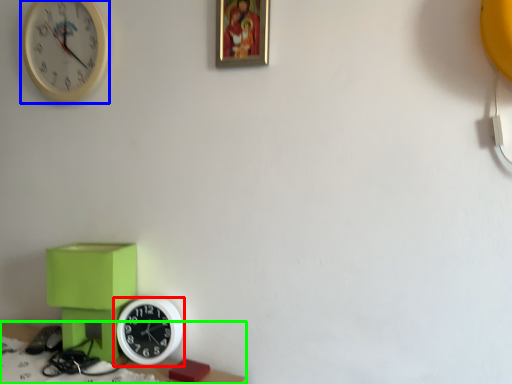
Question: Estimate the real-world distances between objects in this image. Which object is farther from wall clock (highlighted by a red box), wall clock (highlighted by a blue box) or table (highlighted by a green box)?

Choices:
 (A) wall clock
 (B) table

Answer: (A)